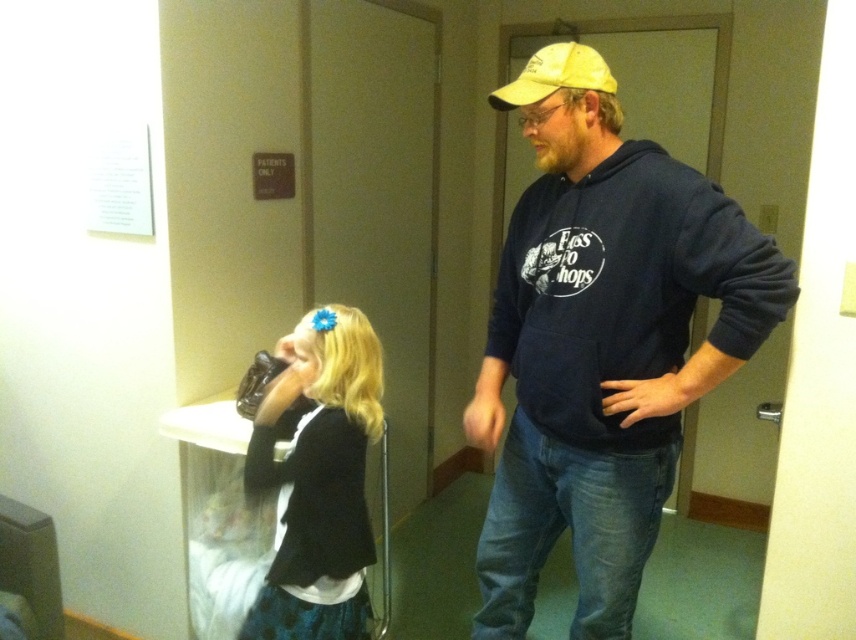
Identify the location of matte black jacket at center. Image resolution: width=856 pixels, height=640 pixels. (318, 480).

Does matte black jacket at center have a larger size compared to yellow fabric baseball cap at upper right?

Yes, matte black jacket at center is bigger than yellow fabric baseball cap at upper right.

Is point (317, 513) in front of point (563, 80)?

No, it is behind (563, 80).

At what (x,y) coordinates should I click in order to perform the action: click on matte black jacket at center. Please return your answer as a coordinate pair (x, y). Looking at the image, I should click on (318, 480).

Between dark blue hoodie at center and matte black jacket at center, which one has less height?

matte black jacket at center is shorter.

I want to click on dark blue hoodie at center, so click(x=603, y=355).

Is dark blue hoodie at center in front of yellow fabric baseball cap at upper right?

Yes, dark blue hoodie at center is closer to the viewer.

Is dark blue hoodie at center further to the viewer compared to yellow fabric baseball cap at upper right?

No, it is not.

Who is more forward, (744,266) or (586,52)?

Point (744,266) is in front.

Where is `dark blue hoodie at center`? dark blue hoodie at center is located at coordinates (603, 355).